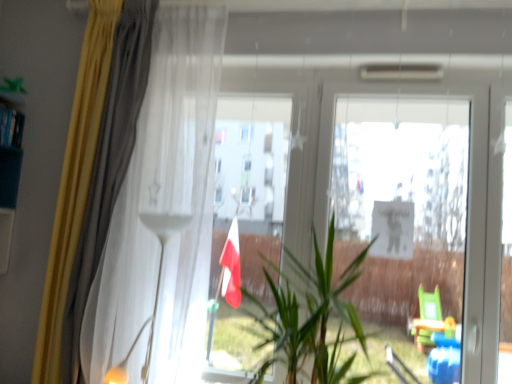
Question: From the image's perspective, is white glossy floor lamp at upper center positioned above or below green leafy plant at center?

Choices:
 (A) above
 (B) below

Answer: (B)

Question: Is white glossy floor lamp at upper center situated inside green leafy plant at center or outside?

Choices:
 (A) inside
 (B) outside

Answer: (B)

Question: Which of these objects is positioned closest to the white glossy floor lamp at upper center?

Choices:
 (A) green leafy plant at center
 (B) yellow fabric curtain at left, which is counted as the 1th curtain, starting from the left
 (C) transparent glass screen door at right
 (D) white sheer curtain at left, the first curtain viewed from the right

Answer: (D)

Question: Considering the real-world distances, which object is closest to the white glossy floor lamp at upper center?

Choices:
 (A) yellow fabric curtain at left, which is counted as the 1th curtain, starting from the left
 (B) green leafy plant at center
 (C) transparent glass screen door at right
 (D) white sheer curtain at left, acting as the second curtain starting from the left

Answer: (D)